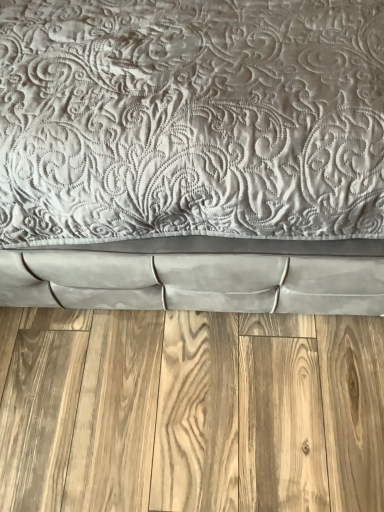
What is the approximate width of satin gray quilted bed at center?

It is 4.46 feet.

This screenshot has width=384, height=512. Describe the element at coordinates (192, 156) in the screenshot. I see `satin gray quilted bed at center` at that location.

In order to face satin gray quilted bed at center, should I rotate leftwards or rightwards?

To align with it, rotate left about 1.318°.

This screenshot has height=512, width=384. In order to click on satin gray quilted bed at center in this screenshot , I will do `click(192, 156)`.

What are the coordinates of `natural wood flooring at bottom` in the screenshot? It's located at point(190,411).

The width and height of the screenshot is (384, 512). What do you see at coordinates (190, 411) in the screenshot? I see `natural wood flooring at bottom` at bounding box center [190, 411].

Identify the location of satin gray quilted bed at center. (192, 156).

Considering the positions of objects satin gray quilted bed at center and natural wood flooring at bottom in the image provided, who is more to the right, satin gray quilted bed at center or natural wood flooring at bottom?

From the viewer's perspective, satin gray quilted bed at center appears more on the right side.

Does satin gray quilted bed at center lie in front of natural wood flooring at bottom?

Yes.

Considering the points (146, 255) and (346, 404), which point is in front, point (146, 255) or point (346, 404)?

Point (146, 255)

From the image's perspective, who appears lower, satin gray quilted bed at center or natural wood flooring at bottom?

natural wood flooring at bottom appears lower in the image.

From a real-world perspective, between satin gray quilted bed at center and natural wood flooring at bottom, who is vertically higher?

satin gray quilted bed at center is physically above.

In terms of width, does satin gray quilted bed at center look wider or thinner when compared to natural wood flooring at bottom?

Clearly, satin gray quilted bed at center has more width compared to natural wood flooring at bottom.

Is satin gray quilted bed at center shorter than natural wood flooring at bottom?

In fact, satin gray quilted bed at center may be taller than natural wood flooring at bottom.

Between satin gray quilted bed at center and natural wood flooring at bottom, which one has larger size?

satin gray quilted bed at center is bigger.

Is satin gray quilted bed at center spatially inside natural wood flooring at bottom, or outside of it?

satin gray quilted bed at center is spatially situated outside natural wood flooring at bottom.

Is there a large distance between satin gray quilted bed at center and natural wood flooring at bottom?

No, satin gray quilted bed at center is not far away from natural wood flooring at bottom.

Is satin gray quilted bed at center oriented towards natural wood flooring at bottom?

Yes, satin gray quilted bed at center is aimed at natural wood flooring at bottom.

How different are the orientations of satin gray quilted bed at center and natural wood flooring at bottom in degrees?

89 degrees separate the facing orientations of satin gray quilted bed at center and natural wood flooring at bottom.

What are the coordinates of `hardwood behind the satin gray quilted bed at center` in the screenshot? It's located at (190, 411).

Is natural wood flooring at bottom at the right side of satin gray quilted bed at center?

No, natural wood flooring at bottom is not to the right of satin gray quilted bed at center.

Between natural wood flooring at bottom and satin gray quilted bed at center, which one is positioned behind?

natural wood flooring at bottom is further away from the camera.

Which is in front, point (294, 412) or point (86, 102)?

Point (86, 102)

From the image's perspective, which one is positioned lower, natural wood flooring at bottom or satin gray quilted bed at center?

From the image's view, natural wood flooring at bottom is below.

In the scene shown: From a real-world perspective, is natural wood flooring at bottom under satin gray quilted bed at center?

Yes, from a real-world perspective, natural wood flooring at bottom is beneath satin gray quilted bed at center.

Can you confirm if natural wood flooring at bottom is wider than satin gray quilted bed at center?

In fact, natural wood flooring at bottom might be narrower than satin gray quilted bed at center.

Considering the sizes of objects natural wood flooring at bottom and satin gray quilted bed at center in the image provided, who is taller, natural wood flooring at bottom or satin gray quilted bed at center?

satin gray quilted bed at center.

Between natural wood flooring at bottom and satin gray quilted bed at center, which one has larger size?

satin gray quilted bed at center.

In the scene shown: Is natural wood flooring at bottom situated inside satin gray quilted bed at center or outside?

natural wood flooring at bottom is outside satin gray quilted bed at center.

Are natural wood flooring at bottom and satin gray quilted bed at center located far from each other?

No, there isn't a large distance between natural wood flooring at bottom and satin gray quilted bed at center.

Could you tell me if natural wood flooring at bottom is facing satin gray quilted bed at center?

No, natural wood flooring at bottom is not facing towards satin gray quilted bed at center.

Measure the distance from natural wood flooring at bottom to satin gray quilted bed at center.

natural wood flooring at bottom and satin gray quilted bed at center are 17.88 inches apart from each other.

Locate an element on the screen. hardwood located on the left of satin gray quilted bed at center is located at coordinates (190, 411).

This screenshot has height=512, width=384. Identify the location of bed above the natural wood flooring at bottom (from the image's perspective). (192, 156).

Identify the location of hardwood lying behind the satin gray quilted bed at center. (190, 411).